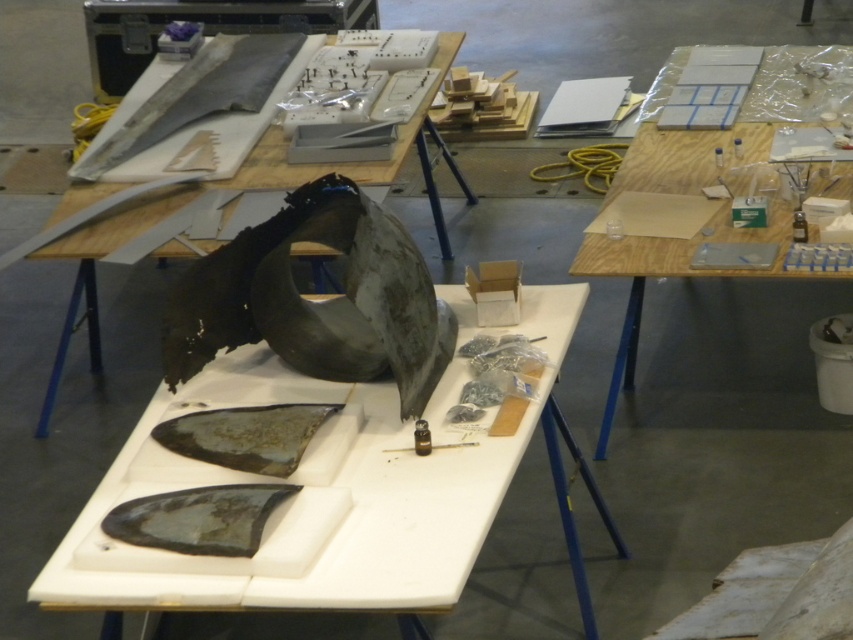
Does point (445, 435) lie behind point (154, 428)?

No, (445, 435) is closer to viewer.

Between point (543, 394) and point (201, 428), which one is positioned behind?

The point (543, 394) is behind.

Image resolution: width=853 pixels, height=640 pixels. What are the coordinates of `matte gray metal at center` in the screenshot? It's located at (318, 497).

Does matte black curved piece at center have a greater width compared to rusty metallic fish at center?

Yes.

Is matte black curved piece at center below rusty metallic fish at center?

No.

Is point (401, 161) in front of point (260, 412)?

No, (401, 161) is behind (260, 412).

You are a GUI agent. You are given a task and a screenshot of the screen. Output one action in this format:
    pyautogui.click(x=<x>, y=<y>)
    Task: Click on the matte black curved piece at center
    The width and height of the screenshot is (853, 640).
    Given the screenshot: What is the action you would take?
    pyautogui.click(x=364, y=163)

Can you confirm if wooden table at center is shorter than shiny metallic fish at lower left?

In fact, wooden table at center may be taller than shiny metallic fish at lower left.

Who is taller, wooden table at center or shiny metallic fish at lower left?

Standing taller between the two is wooden table at center.

Where is `wooden table at center`? The image size is (853, 640). wooden table at center is located at coordinates click(720, 128).

The width and height of the screenshot is (853, 640). I want to click on wooden table at center, so click(720, 128).